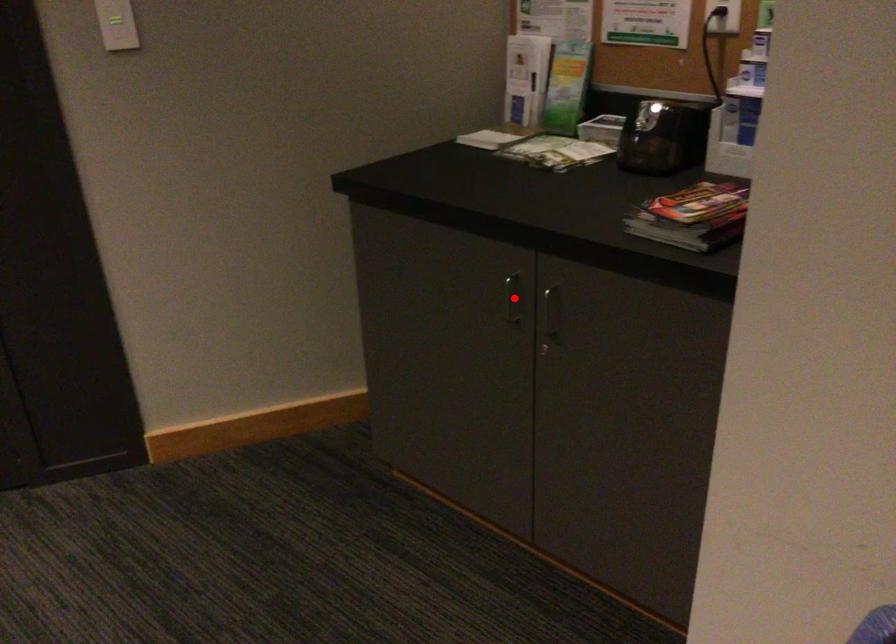
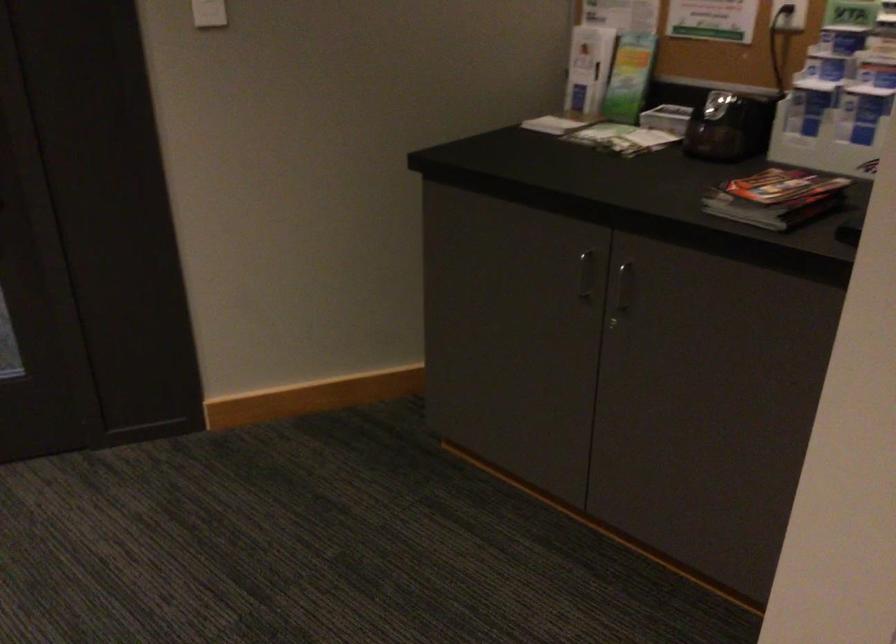
The point at the highlighted location is marked in the first image. Where is the corresponding point in the second image?

(584, 275)